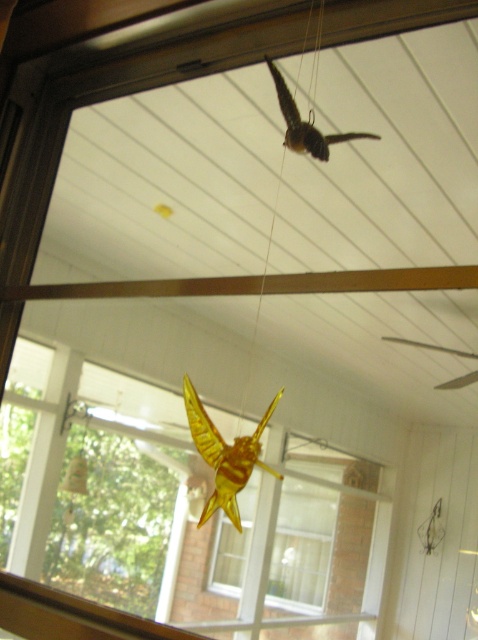
Question: Can you confirm if translucent amber insect at center is thinner than brown matte bird at upper center?

Choices:
 (A) yes
 (B) no

Answer: (A)

Question: In this image, where is brown wooden beam at center located relative to translucent amber insect at center?

Choices:
 (A) below
 (B) above

Answer: (B)

Question: Is brown wooden beam at center thinner than translucent amber insect at center?

Choices:
 (A) no
 (B) yes

Answer: (A)

Question: Estimate the real-world distances between objects in this image. Which object is closer to the brown wooden beam at center?

Choices:
 (A) brown matte bird at upper center
 (B) translucent amber insect at center

Answer: (B)

Question: Which point is farther to the camera?

Choices:
 (A) (299, 113)
 (B) (347, 289)
 (C) (216, 452)
 (D) (437, 529)

Answer: (D)

Question: Which point is farther to the camera?

Choices:
 (A) translucent yellow insect at upper center
 (B) translucent amber insect at center
 (C) brown matte bird at upper center

Answer: (A)